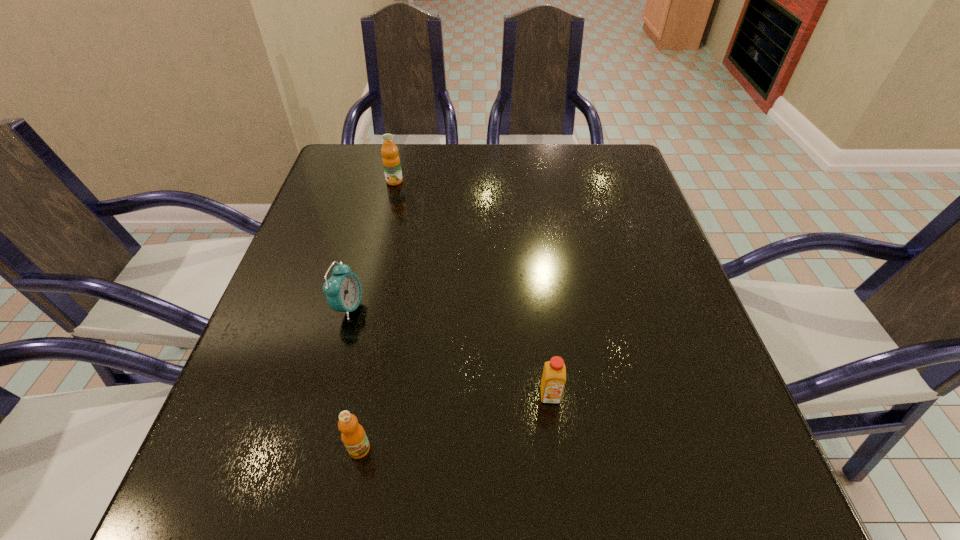
At what (x,y) coordinates should I click in order to perform the action: click on blank area located on the front and back of the third farthest object. Please return your answer as a coordinate pair (x, y). The height and width of the screenshot is (540, 960). Looking at the image, I should click on (564, 507).

Locate an element on the screen. The height and width of the screenshot is (540, 960). object present at the far edge is located at coordinates (391, 162).

Identify the location of orange juice that is positioned at the left edge. The image size is (960, 540). (391, 162).

Where is `alarm clock that is at the left edge`? This screenshot has width=960, height=540. alarm clock that is at the left edge is located at coordinates (343, 290).

Locate an element on the screen. The width and height of the screenshot is (960, 540). object at the far left corner is located at coordinates (391, 162).

In the image, there is a desktop. In order to click on vacant area at the far edge in this screenshot , I will do `click(457, 158)`.

Locate an element on the screen. The width and height of the screenshot is (960, 540). vacant space at the near edge of the desktop is located at coordinates (459, 531).

Identify the location of free space at the left edge. This screenshot has height=540, width=960. [274, 417].

The width and height of the screenshot is (960, 540). Find the location of `vacant region at the right edge`. vacant region at the right edge is located at coordinates (722, 411).

This screenshot has width=960, height=540. What are the coordinates of `vacant space at the far left corner of the desktop` in the screenshot? It's located at (382, 183).